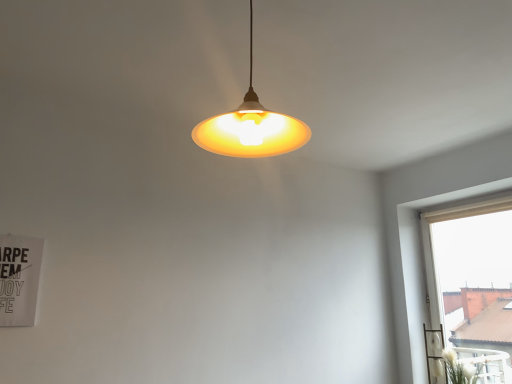
Question: From the image's perspective, is beige fabric curtain at right on white fluffy plant at lower right?

Choices:
 (A) yes
 (B) no

Answer: (A)

Question: Is beige fabric curtain at right positioned behind white fluffy plant at lower right?

Choices:
 (A) yes
 (B) no

Answer: (B)

Question: Does beige fabric curtain at right lie in front of white fluffy plant at lower right?

Choices:
 (A) no
 (B) yes

Answer: (B)

Question: Does beige fabric curtain at right appear on the right side of white fluffy plant at lower right?

Choices:
 (A) no
 (B) yes

Answer: (B)

Question: Is white fluffy plant at lower right completely or partially inside beige fabric curtain at right?

Choices:
 (A) no
 (B) yes

Answer: (A)

Question: From a real-world perspective, is beige fabric curtain at right located higher than white fluffy plant at lower right?

Choices:
 (A) no
 (B) yes

Answer: (B)

Question: Is white fluffy plant at lower right at the right side of beige fabric curtain at right?

Choices:
 (A) yes
 (B) no

Answer: (B)

Question: Is beige fabric curtain at right a part of white fluffy plant at lower right?

Choices:
 (A) no
 (B) yes

Answer: (A)

Question: Considering the relative sizes of white fluffy plant at lower right and beige fabric curtain at right in the image provided, is white fluffy plant at lower right smaller than beige fabric curtain at right?

Choices:
 (A) no
 (B) yes

Answer: (B)

Question: Is white fluffy plant at lower right turned away from beige fabric curtain at right?

Choices:
 (A) yes
 (B) no

Answer: (A)

Question: Is white fluffy plant at lower right positioned before beige fabric curtain at right?

Choices:
 (A) no
 (B) yes

Answer: (A)

Question: Is white fluffy plant at lower right next to beige fabric curtain at right and touching it?

Choices:
 (A) no
 (B) yes

Answer: (A)

Question: From a real-world perspective, is matte yellow plastic lampshade at center positioned under white fluffy plant at lower right based on gravity?

Choices:
 (A) no
 (B) yes

Answer: (A)